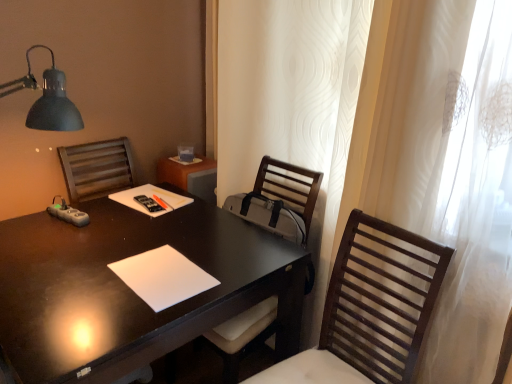
Question: Is black glossy desk at center positioned far away from white sheer curtain at right?

Choices:
 (A) no
 (B) yes

Answer: (A)

Question: Can you confirm if black glossy desk at center is bigger than white sheer curtain at right?

Choices:
 (A) no
 (B) yes

Answer: (B)

Question: From a real-world perspective, does black glossy desk at center sit lower than white sheer curtain at right?

Choices:
 (A) yes
 (B) no

Answer: (A)

Question: Is black glossy desk at center closer to the viewer compared to white sheer curtain at right?

Choices:
 (A) yes
 (B) no

Answer: (B)

Question: Is black glossy desk at center positioned behind white sheer curtain at right?

Choices:
 (A) no
 (B) yes

Answer: (B)

Question: From a real-world perspective, relative to wooden chair at center, which ranks as the first chair in back-to-front order, is wooden slats chair at right, marked as the first chair in a front-to-back arrangement, vertically above or below?

Choices:
 (A) above
 (B) below

Answer: (A)

Question: Is wooden slats chair at right, which is the 2th chair in back-to-front order, inside or outside of wooden chair at center, positioned as the 2th chair in front-to-back order?

Choices:
 (A) inside
 (B) outside

Answer: (B)

Question: Would you say wooden slats chair at right, which is the 2th chair in back-to-front order, is to the left or to the right of wooden chair at center, positioned as the 2th chair in front-to-back order, in the picture?

Choices:
 (A) left
 (B) right

Answer: (B)

Question: Is wooden slats chair at right, which is the 2th chair in back-to-front order, taller or shorter than wooden chair at center, positioned as the 2th chair in front-to-back order?

Choices:
 (A) tall
 (B) short

Answer: (B)

Question: Which is correct: white matte notepad at center is inside wooden chair at center, positioned as the 2th chair in front-to-back order, or outside of it?

Choices:
 (A) outside
 (B) inside

Answer: (A)

Question: Considering the positions of white matte notepad at center and wooden chair at center, positioned as the 2th chair in front-to-back order, in the image, is white matte notepad at center taller or shorter than wooden chair at center, positioned as the 2th chair in front-to-back order,?

Choices:
 (A) tall
 (B) short

Answer: (B)

Question: Looking at their shapes, would you say white matte notepad at center is wider or thinner than wooden chair at center, positioned as the 2th chair in front-to-back order?

Choices:
 (A) wide
 (B) thin

Answer: (B)

Question: From the image's perspective, relative to wooden chair at center, which ranks as the first chair in back-to-front order, is white matte notepad at center above or below?

Choices:
 (A) above
 (B) below

Answer: (A)

Question: Is wooden chair at center, positioned as the 2th chair in front-to-back order, wider or thinner than wooden slats chair at right, marked as the first chair in a front-to-back arrangement?

Choices:
 (A) thin
 (B) wide

Answer: (B)

Question: Looking at the image, does wooden chair at center, positioned as the 2th chair in front-to-back order, seem bigger or smaller compared to wooden slats chair at right, marked as the first chair in a front-to-back arrangement?

Choices:
 (A) small
 (B) big

Answer: (B)